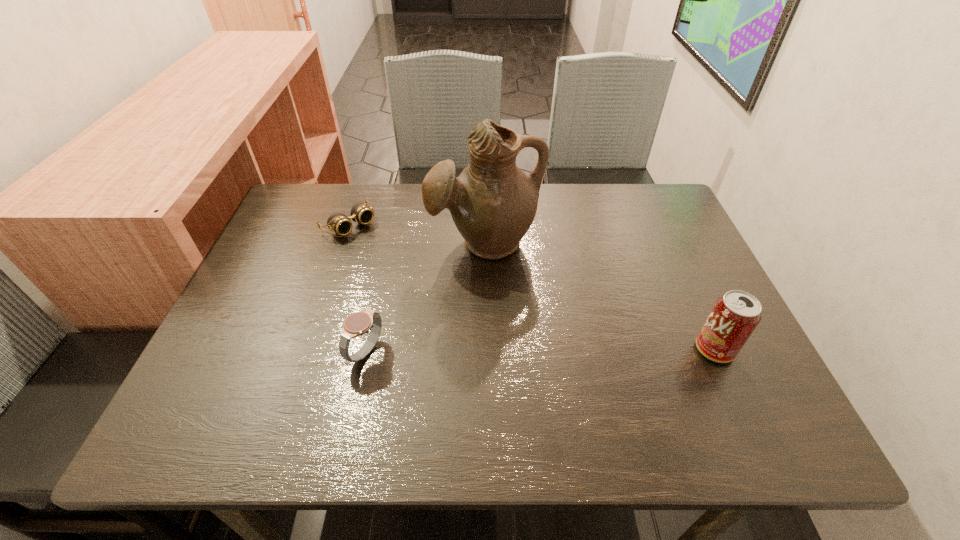
Locate an element on the screen. Image resolution: width=960 pixels, height=540 pixels. empty space between the third object from right to left and the second object from right to left is located at coordinates (425, 297).

Where is `free space between the third object from left to right and the second tallest object`? The height and width of the screenshot is (540, 960). free space between the third object from left to right and the second tallest object is located at coordinates (599, 295).

The image size is (960, 540). Identify the location of vacant space that's between the watch and the leftmost object. (358, 288).

At what (x,y) coordinates should I click in order to perform the action: click on free space between the pitcher and the watch. Please return your answer as a coordinate pair (x, y). The width and height of the screenshot is (960, 540). Looking at the image, I should click on (425, 297).

Locate an element on the screen. unoccupied area between the leftmost object and the third object from right to left is located at coordinates (358, 288).

At what (x,y) coordinates should I click in order to perform the action: click on vacant space in between the third tallest object and the shortest object. Please return your answer as a coordinate pair (x, y). Image resolution: width=960 pixels, height=540 pixels. Looking at the image, I should click on (358, 288).

You are a GUI agent. You are given a task and a screenshot of the screen. Output one action in this format:
    pyautogui.click(x=<x>, y=<y>)
    Task: Click on the free space between the third tallest object and the soda can
    Image resolution: width=960 pixels, height=540 pixels.
    Given the screenshot: What is the action you would take?
    pyautogui.click(x=540, y=350)

What are the coordinates of `free space between the shortest object and the third tallest object` in the screenshot? It's located at (358, 288).

You are a GUI agent. You are given a task and a screenshot of the screen. Output one action in this format:
    pyautogui.click(x=<x>, y=<y>)
    Task: Click on the free space that is in between the second tallest object and the goggles
    
    Given the screenshot: What is the action you would take?
    pyautogui.click(x=532, y=287)

Where is `unoccupied position between the rightmost object and the second object from right to left`? unoccupied position between the rightmost object and the second object from right to left is located at coordinates (599, 295).